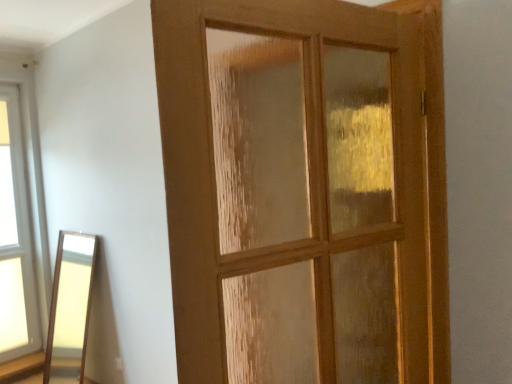
What do you see at coordinates (15, 239) in the screenshot? I see `clear glass window at left` at bounding box center [15, 239].

The height and width of the screenshot is (384, 512). I want to click on clear glass window at left, so click(x=15, y=239).

The image size is (512, 384). Identify the location of wooden door at center. (303, 191).

What do you see at coordinates (303, 191) in the screenshot? I see `wooden door at center` at bounding box center [303, 191].

In order to face wooden door at center, should I rotate leftwards or rightwards?

Turn right approximately 9.623 degrees to face it.

You are a GUI agent. You are given a task and a screenshot of the screen. Output one action in this format:
    pyautogui.click(x=<x>, y=<y>)
    Task: Click on the clear glass window at left
    The height and width of the screenshot is (384, 512).
    Given the screenshot: What is the action you would take?
    pyautogui.click(x=15, y=239)

Does wooden door at center appear on the left side of clear glass window at left?

In fact, wooden door at center is to the right of clear glass window at left.

Which object is further away from the camera taking this photo, wooden door at center or clear glass window at left?

clear glass window at left is further away from the camera.

Between point (354, 117) and point (20, 244), which one is positioned in front?

The point (354, 117) is closer.

From the image's perspective, which is below, wooden door at center or clear glass window at left?

clear glass window at left.

From a real-world perspective, relative to clear glass window at left, is wooden door at center vertically above or below?

wooden door at center is above clear glass window at left.

Between wooden door at center and clear glass window at left, which one has smaller width?

clear glass window at left is thinner.

Considering the sizes of objects wooden door at center and clear glass window at left in the image provided, who is shorter, wooden door at center or clear glass window at left?

With less height is wooden door at center.

Who is smaller, wooden door at center or clear glass window at left?

clear glass window at left is smaller.

Do you think wooden door at center is within clear glass window at left, or outside of it?

wooden door at center is spatially situated outside clear glass window at left.

Would you consider wooden door at center to be distant from clear glass window at left?

That's right, there is a large distance between wooden door at center and clear glass window at left.

Does wooden door at center turn towards clear glass window at left?

Yes, wooden door at center is turned towards clear glass window at left.

At what (x,y) coordinates should I click in order to perform the action: click on door above the clear glass window at left (from the image's perspective). Please return your answer as a coordinate pair (x, y). The image size is (512, 384). Looking at the image, I should click on (303, 191).

Which object is positioned more to the left, clear glass window at left or wooden door at center?

Positioned to the left is clear glass window at left.

Does clear glass window at left lie in front of wooden door at center?

No, the depth of clear glass window at left is greater than that of wooden door at center.

Does point (25, 292) lie behind point (169, 86)?

Yes, it is.

From the image's perspective, is clear glass window at left positioned above or below wooden door at center?

Based on their image positions, clear glass window at left is located beneath wooden door at center.

From a real-world perspective, is clear glass window at left positioned under wooden door at center based on gravity?

Indeed, from a real-world perspective, clear glass window at left is positioned beneath wooden door at center.

Does clear glass window at left have a greater width compared to wooden door at center?

Incorrect, the width of clear glass window at left does not surpass that of wooden door at center.

Based on the photo, between clear glass window at left and wooden door at center, which one has less height?

wooden door at center.

Considering the relative sizes of clear glass window at left and wooden door at center in the image provided, is clear glass window at left bigger than wooden door at center?

No, clear glass window at left is not bigger than wooden door at center.

Is clear glass window at left located outside wooden door at center?

That's correct, clear glass window at left is outside of wooden door at center.

Is clear glass window at left far away from wooden door at center?

Yes.

Does clear glass window at left turn towards wooden door at center?

Yes, clear glass window at left is turned towards wooden door at center.

How different are the orientations of clear glass window at left and wooden door at center in degrees?

clear glass window at left and wooden door at center are facing 167 degrees away from each other.

You are a GUI agent. You are given a task and a screenshot of the screen. Output one action in this format:
    pyautogui.click(x=<x>, y=<y>)
    Task: Click on the window below the wooden door at center (from the image's perspective)
    The width and height of the screenshot is (512, 384).
    Given the screenshot: What is the action you would take?
    pyautogui.click(x=15, y=239)

Identify the location of window below the wooden door at center (from the image's perspective). The height and width of the screenshot is (384, 512). (15, 239).

Where is `window located underneath the wooden door at center (from a real-world perspective)`? Image resolution: width=512 pixels, height=384 pixels. window located underneath the wooden door at center (from a real-world perspective) is located at coordinates (15, 239).